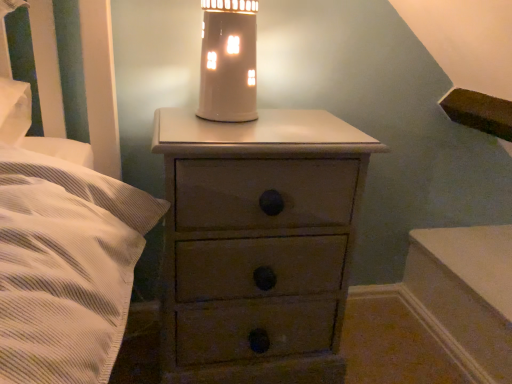
The height and width of the screenshot is (384, 512). I want to click on vacant area that is in front of matte white oil lamp at upper center, so click(x=223, y=136).